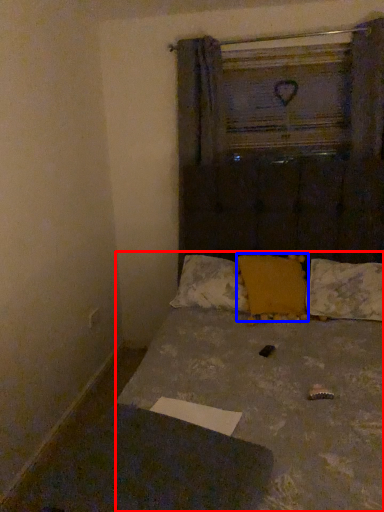
Question: Which object appears farthest to the camera in this image, bed (highlighted by a red box) or pillow (highlighted by a blue box)?

Choices:
 (A) bed
 (B) pillow

Answer: (B)